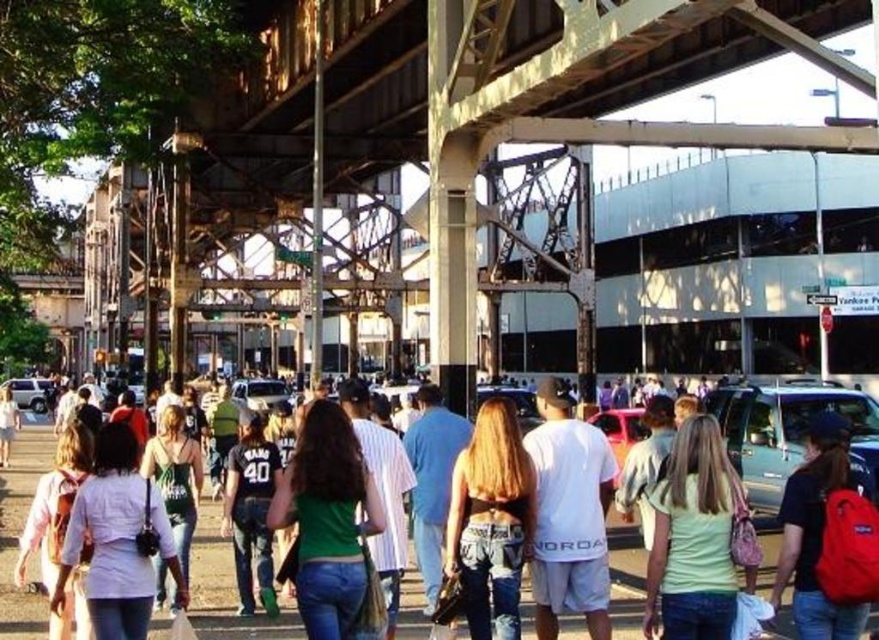
You are a delivery person carrying a heavy package and need to cross the street. You see the metallic steel bridge at center and the denim jeans at center. Which object is above the other?

The metallic steel bridge at center is positioned over denim jeans at center, so the bridge is above the jeans.

Based on the photo, you are a photographer standing at the center of the scene. You notice two items of clothing at the center of the image. Which one is taller between the denim shorts at center and the white matte shirt at center?

The denim shorts at center is taller than the white matte shirt at center according to the description.

You are a photographer trying to capture a candid shot of two people walking in the city. You see a person wearing denim shorts at center and another in a white matte shirt at center. Which clothing item is positioned more to the right side of the frame?

The denim shorts at center are to the right of the white matte shirt at center, so the denim shorts at center are positioned more to the right side of the frame.